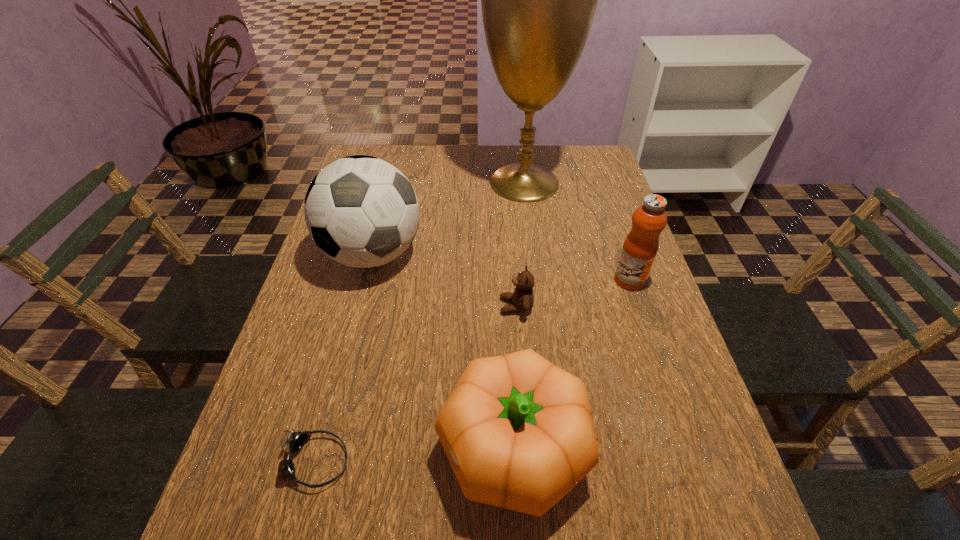
Identify the location of vacant area situated on the carved face of the pumpkin. (325, 449).

The height and width of the screenshot is (540, 960). What are the coordinates of `vacant region located 0.100m on the carved face of the pumpkin` in the screenshot? It's located at point(384,449).

Locate an element on the screen. Image resolution: width=960 pixels, height=540 pixels. vacant space located on the carved face of the pumpkin is located at coordinates pos(299,449).

This screenshot has height=540, width=960. Find the location of `vacant space located at the face of the second shortest object`. vacant space located at the face of the second shortest object is located at coordinates (352, 306).

Locate an element on the screen. vacant space located at the face of the second shortest object is located at coordinates (401, 306).

At what (x,y) coordinates should I click in order to perform the action: click on vacant space located 0.360m at the face of the second shortest object. Please return your answer as a coordinate pair (x, y). This screenshot has width=960, height=540. Looking at the image, I should click on (352, 306).

What are the coordinates of `vacant area situated 0.180m through the lenses of the shortest object` in the screenshot? It's located at (447, 462).

This screenshot has width=960, height=540. I want to click on object that is at the far edge, so click(x=538, y=0).

This screenshot has width=960, height=540. Identify the location of soccer ball that is at the left edge. (362, 212).

Locate an element on the screen. Image resolution: width=960 pixels, height=540 pixels. goggles at the left edge is located at coordinates (295, 441).